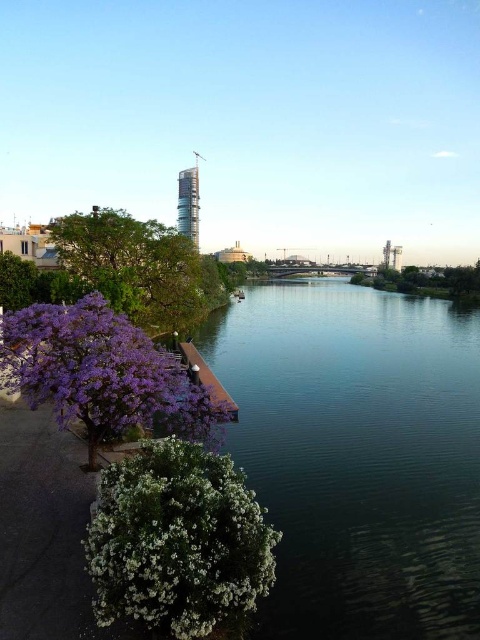
Does dark blue water at center appear under green leafy tree at left?

Correct, dark blue water at center is located below green leafy tree at left.

Is dark blue water at center to the left of green leafy tree at left from the viewer's perspective?

In fact, dark blue water at center is to the right of green leafy tree at left.

Identify the location of dark blue water at center. (358, 456).

Can you confirm if white fluffy bush at lower left is taller than green leafy tree at left?

In fact, white fluffy bush at lower left may be shorter than green leafy tree at left.

Who is more distant from viewer, (144,477) or (79,278)?

Point (79,278)

Identify the location of white fluffy bush at lower left. This screenshot has height=640, width=480. (178, 541).

Does dark blue water at center have a greater width compared to white fluffy bush at lower left?

Yes, dark blue water at center is wider than white fluffy bush at lower left.

Does dark blue water at center come behind white fluffy bush at lower left?

Yes, it is behind white fluffy bush at lower left.

Who is more forward, (361,625) or (141,595)?

Point (141,595) is more forward.

Locate an element on the screen. The height and width of the screenshot is (640, 480). dark blue water at center is located at coordinates (358, 456).